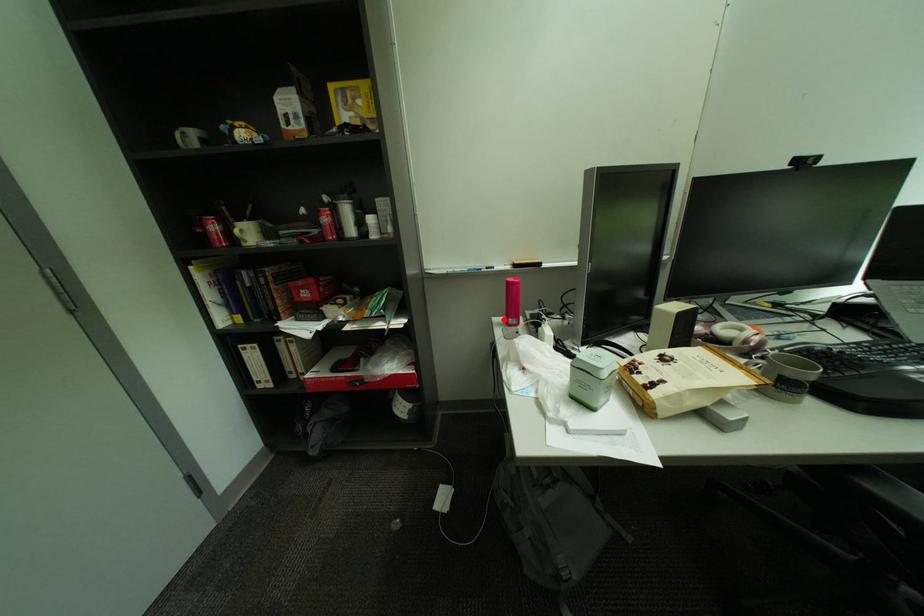
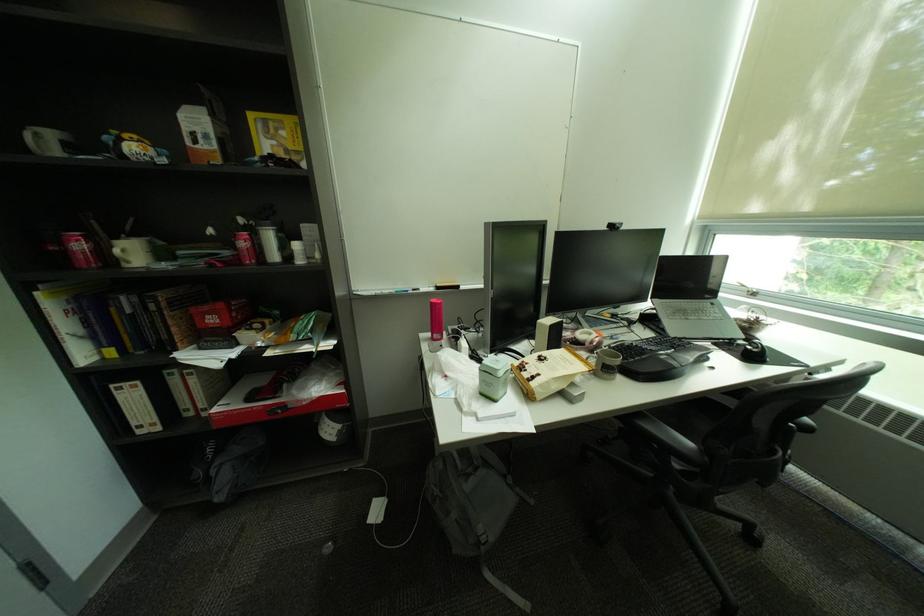
Find the pixel in the second image that matches the highlighted location in the first image.

(431, 334)